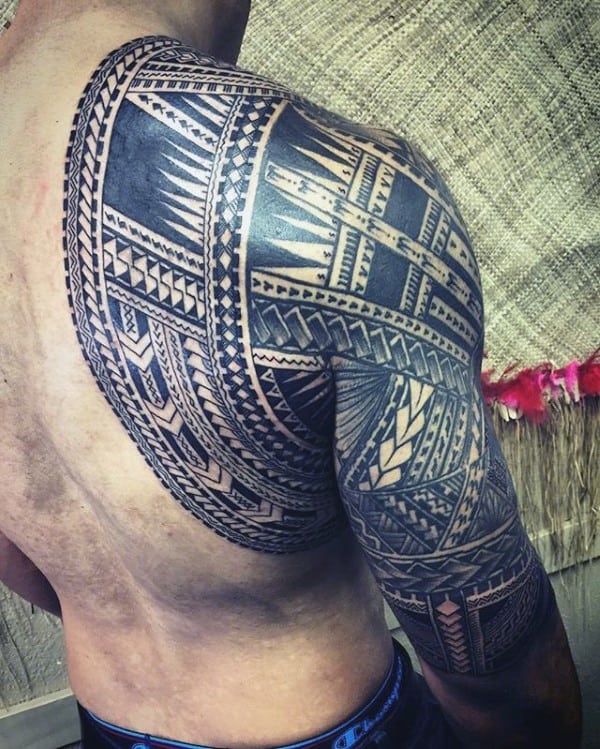
Where is `wood paneling`? The width and height of the screenshot is (600, 749). wood paneling is located at coordinates (45, 708), (30, 661), (580, 625).